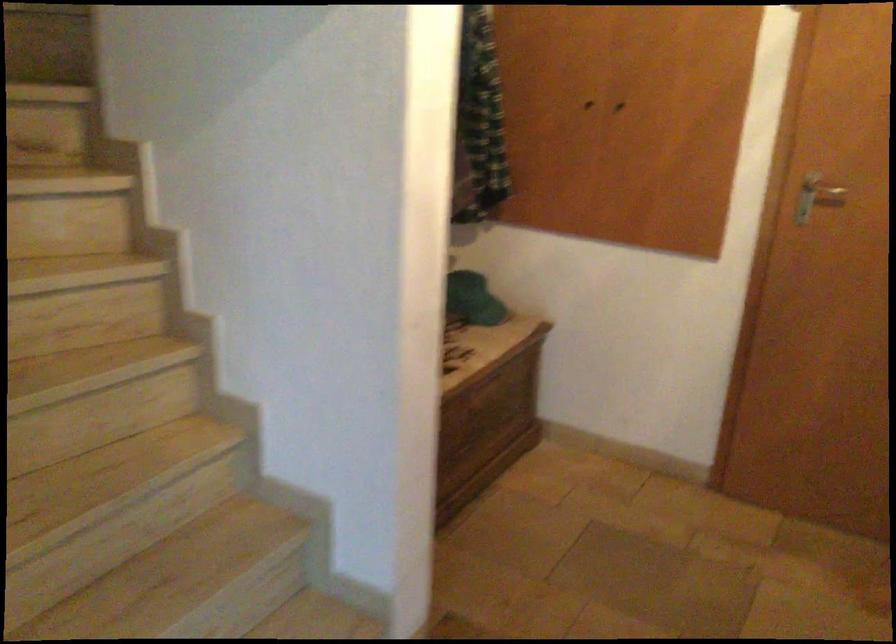
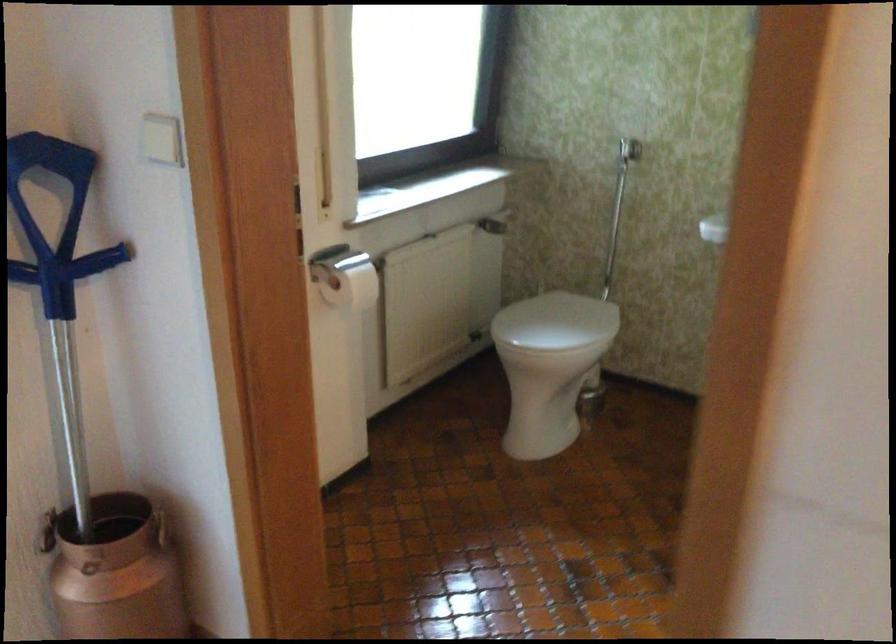
How did the camera likely rotate?

The rotation direction of the camera is left-down.